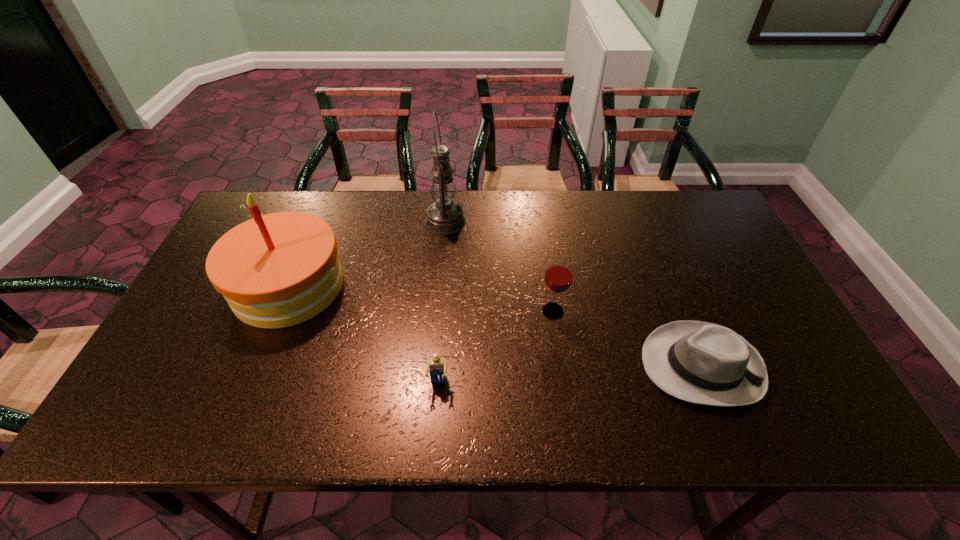
Identify the location of vacant space situated on the front-facing side of the fedora. The height and width of the screenshot is (540, 960). (517, 366).

Where is `vacant space positioned 0.270m on the front-facing side of the fedora`? vacant space positioned 0.270m on the front-facing side of the fedora is located at coordinates (530, 366).

This screenshot has width=960, height=540. Identify the location of vacant space located on the front-facing side of the fedora. (488, 366).

The image size is (960, 540). Identify the location of vacant space situated on the face of the Lego. (436, 419).

Identify the location of object located in the far edge section of the desktop. The height and width of the screenshot is (540, 960). (445, 216).

This screenshot has width=960, height=540. Find the location of `object present at the near edge`. object present at the near edge is located at coordinates (704, 363).

Locate an element on the screen. object that is at the left edge is located at coordinates (276, 270).

This screenshot has height=540, width=960. In order to click on object present at the right edge in this screenshot , I will do `click(704, 363)`.

Identify the location of object located in the near right corner section of the desktop. (704, 363).

Identify the location of vacant position at the far edge of the desktop. (606, 209).